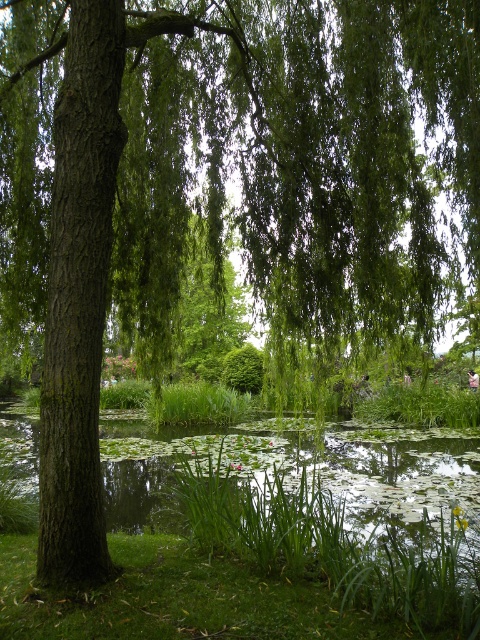
Question: Which object appears farthest from the camera in this image?

Choices:
 (A) green grassy lake at lower left
 (B) green grass at lower center

Answer: (A)

Question: Does green grassy lake at lower left have a larger size compared to green grass at lower center?

Choices:
 (A) yes
 (B) no

Answer: (A)

Question: Where is green grassy lake at lower left located in relation to green grass at lower center in the image?

Choices:
 (A) below
 (B) above

Answer: (A)

Question: Which of the following is the closest to the observer?

Choices:
 (A) (337, 616)
 (B) (272, 442)

Answer: (A)

Question: Is green grassy lake at lower left closer to the viewer compared to green grass at lower center?

Choices:
 (A) yes
 (B) no

Answer: (B)

Question: Which object is closer to the camera taking this photo?

Choices:
 (A) green grassy lake at lower left
 (B) green grass at lower center

Answer: (B)